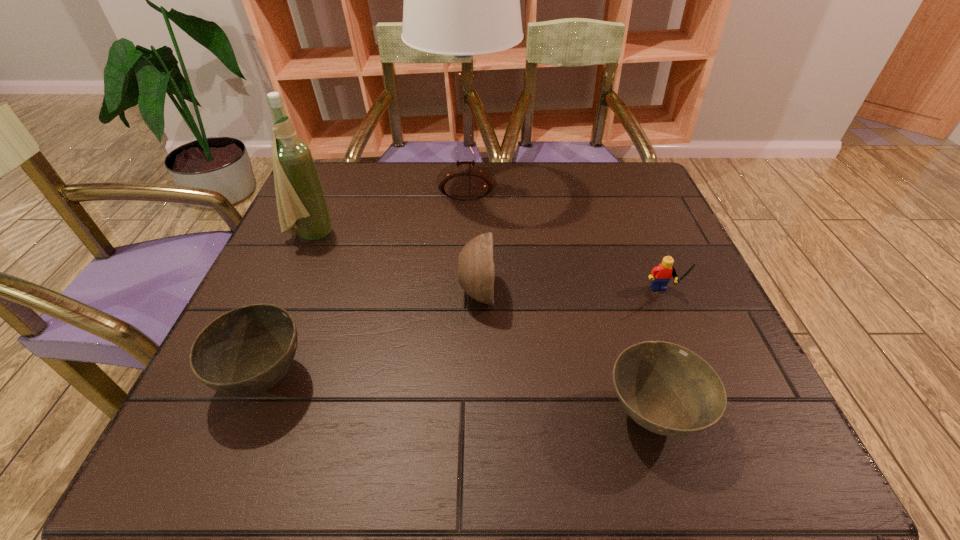
Locate an element on the screen. bowl that stands as the closest to the Lego is located at coordinates (667, 389).

Where is `free point that satisfies the following two spatial constraints: 1. on the front-facing side of the tallest object; 2. on the back side of the rightmost bowl`? The width and height of the screenshot is (960, 540). free point that satisfies the following two spatial constraints: 1. on the front-facing side of the tallest object; 2. on the back side of the rightmost bowl is located at coordinates (457, 415).

Where is `vacant space that satisfies the following two spatial constraints: 1. on the front-facing side of the table lamp; 2. on the left side of the rightmost bowl`? This screenshot has height=540, width=960. vacant space that satisfies the following two spatial constraints: 1. on the front-facing side of the table lamp; 2. on the left side of the rightmost bowl is located at coordinates (457, 415).

At what (x,y) coordinates should I click in order to perform the action: click on free region that satisfies the following two spatial constraints: 1. on the front-facing side of the rightmost bowl; 2. on the right side of the tallest object. Please return your answer as a coordinate pair (x, y). Looking at the image, I should click on click(x=457, y=415).

At what (x,y) coordinates should I click in order to perform the action: click on free spot that satisfies the following two spatial constraints: 1. on the front-facing side of the leftmost bowl; 2. on the right side of the fifth shortest object. Please return your answer as a coordinate pair (x, y). Looking at the image, I should click on (248, 379).

Where is `vacant space that satisfies the following two spatial constraints: 1. on the front-facing side of the leftmost bowl; 2. on the right side of the second tallest object`? vacant space that satisfies the following two spatial constraints: 1. on the front-facing side of the leftmost bowl; 2. on the right side of the second tallest object is located at coordinates (248, 379).

Locate an element on the screen. The height and width of the screenshot is (540, 960). free space that satisfies the following two spatial constraints: 1. on the front-facing side of the wine bottle; 2. on the left side of the leftmost bowl is located at coordinates (248, 379).

Locate an element on the screen. free spot that satisfies the following two spatial constraints: 1. on the back side of the rightmost bowl; 2. on the front-facing side of the fifth nearest object is located at coordinates (597, 235).

Locate an element on the screen. The image size is (960, 540). vacant space that satisfies the following two spatial constraints: 1. on the front-facing side of the table lamp; 2. on the back side of the tallest bowl is located at coordinates (462, 294).